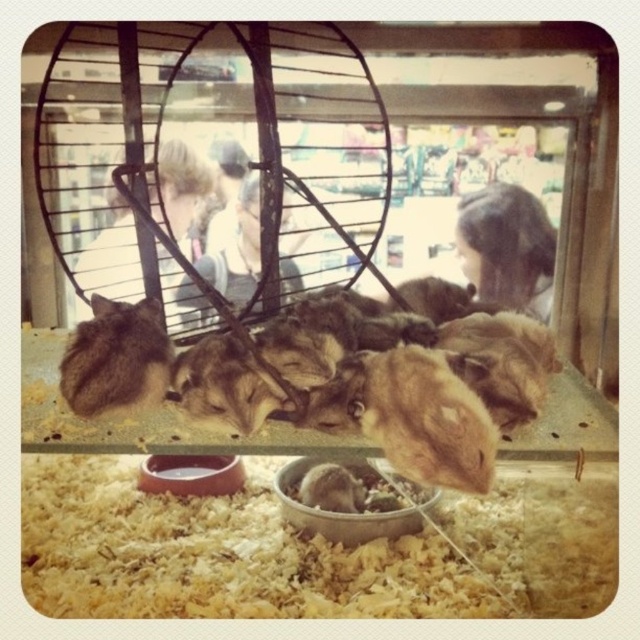
Question: Does brown fluffy hamster at center have a smaller size compared to fuzzy brown fur at lower left?

Choices:
 (A) no
 (B) yes

Answer: (A)

Question: Can you confirm if brown fluffy hamster at center is positioned to the left of fuzzy brown fur at lower left?

Choices:
 (A) yes
 (B) no

Answer: (B)

Question: Which of the following is the farthest from the observer?

Choices:
 (A) brown fluffy hamster at center
 (B) fuzzy brown fur at lower left

Answer: (B)

Question: Which point appears closest to the camera in this image?

Choices:
 (A) (326, 305)
 (B) (93, 310)

Answer: (B)

Question: Is brown fluffy hamster at center above fuzzy brown fur at lower left?

Choices:
 (A) yes
 (B) no

Answer: (B)